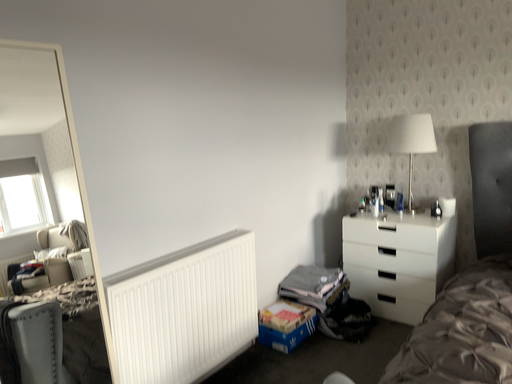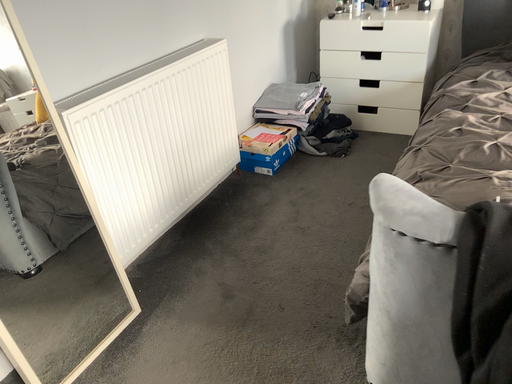
Question: How did the camera likely rotate when shooting the video?

Choices:
 (A) rotated downward
 (B) rotated upward

Answer: (A)